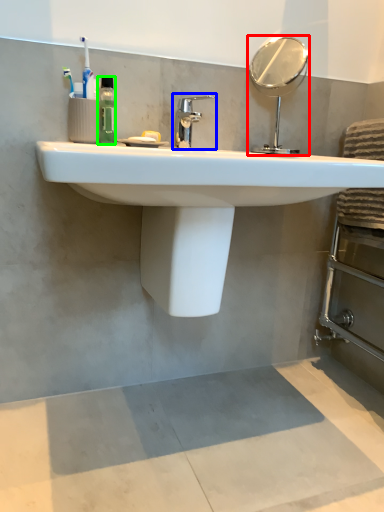
Question: Which is nearer to the mirror (highlighted by a red box)? tap (highlighted by a blue box) or mouthwash (highlighted by a green box).

Choices:
 (A) tap
 (B) mouthwash

Answer: (A)